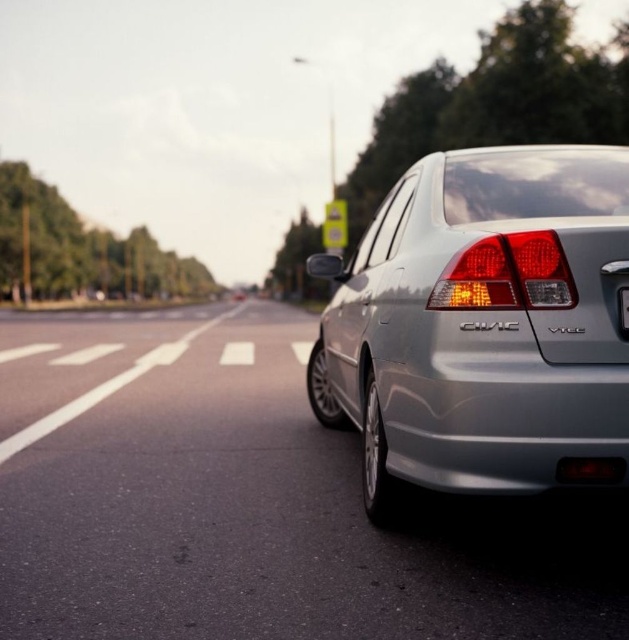
Does satin silver sedan at center appear on the left side of matte plastic brake light at rear?

Indeed, satin silver sedan at center is positioned on the left side of matte plastic brake light at rear.

Between satin silver sedan at center and matte plastic brake light at rear, which one appears on the left side from the viewer's perspective?

Positioned to the left is satin silver sedan at center.

This screenshot has height=640, width=629. I want to click on satin silver sedan at center, so click(x=482, y=326).

The width and height of the screenshot is (629, 640). I want to click on satin silver sedan at center, so click(482, 326).

Is satin silver sedan at center positioned in front of black plastic license plate at rear?

Yes, satin silver sedan at center is in front of black plastic license plate at rear.

Based on the photo, does satin silver sedan at center appear on the right side of black plastic license plate at rear?

Incorrect, satin silver sedan at center is not on the right side of black plastic license plate at rear.

In order to click on satin silver sedan at center in this screenshot , I will do `click(482, 326)`.

Is point (538, 276) behind point (625, 308)?

Yes, it is behind point (625, 308).

Which is behind, point (548, 296) or point (625, 307)?

The point (548, 296) is behind.

This screenshot has width=629, height=640. I want to click on matte plastic brake light at rear, so click(506, 275).